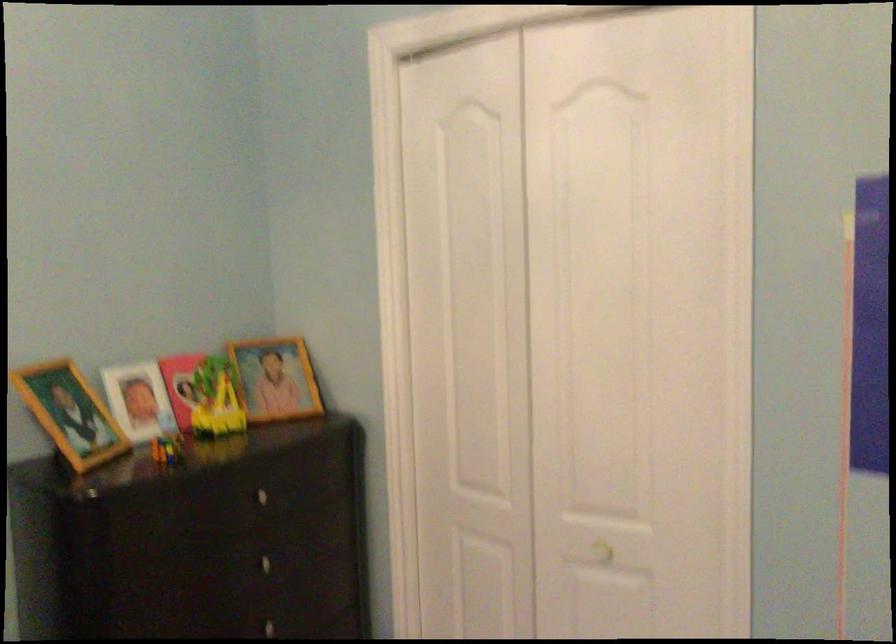
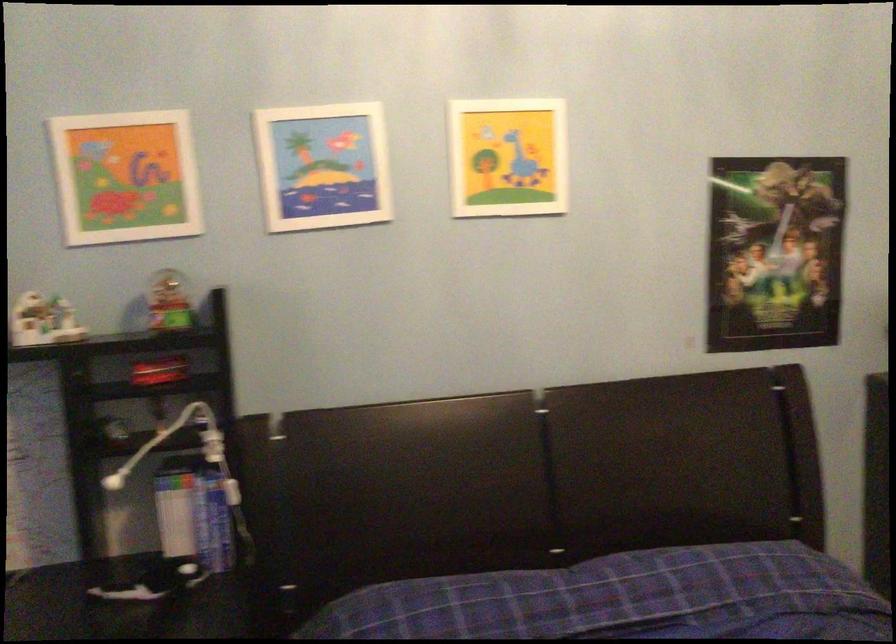
Question: The images are taken continuously from a first-person perspective. In which direction is your viewpoint rotating?

Choices:
 (A) Left
 (B) Right
 (C) Up
 (D) Down

Answer: (A)